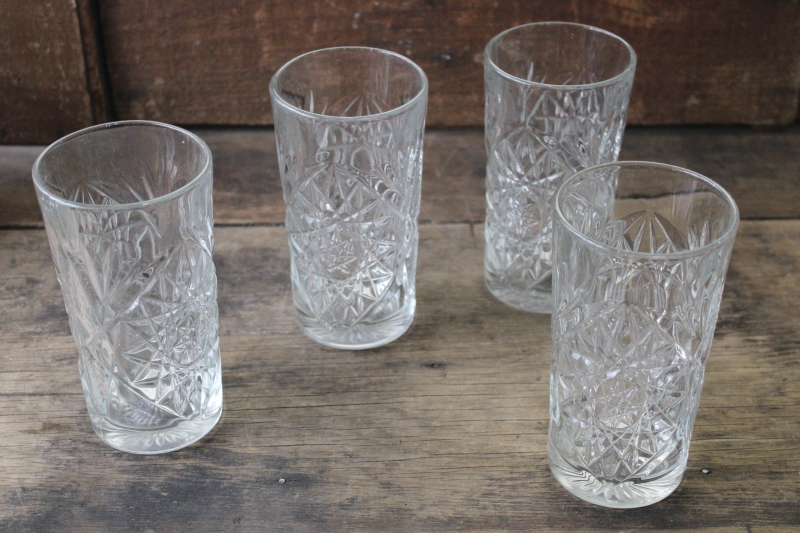
I want to click on first glass from left, so click(x=120, y=317).